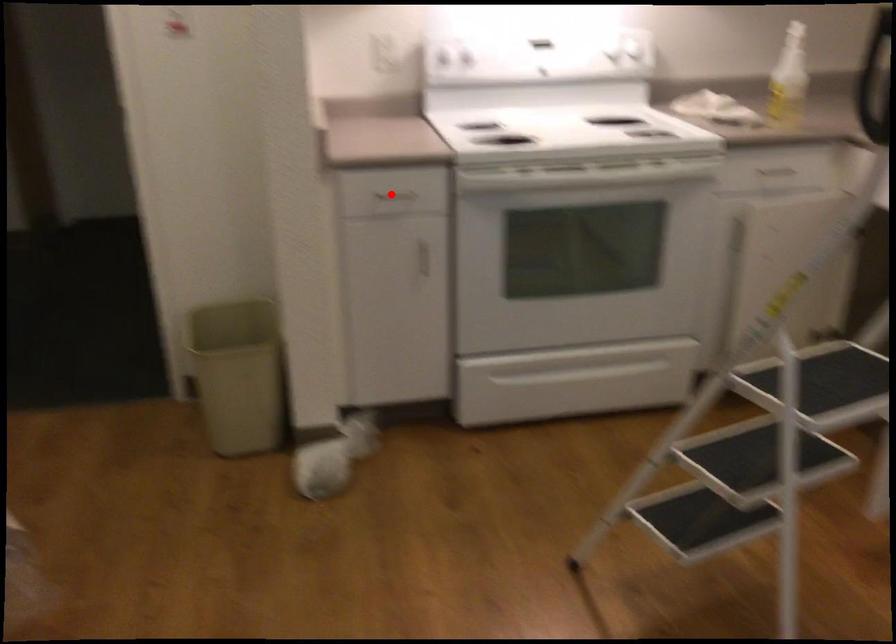
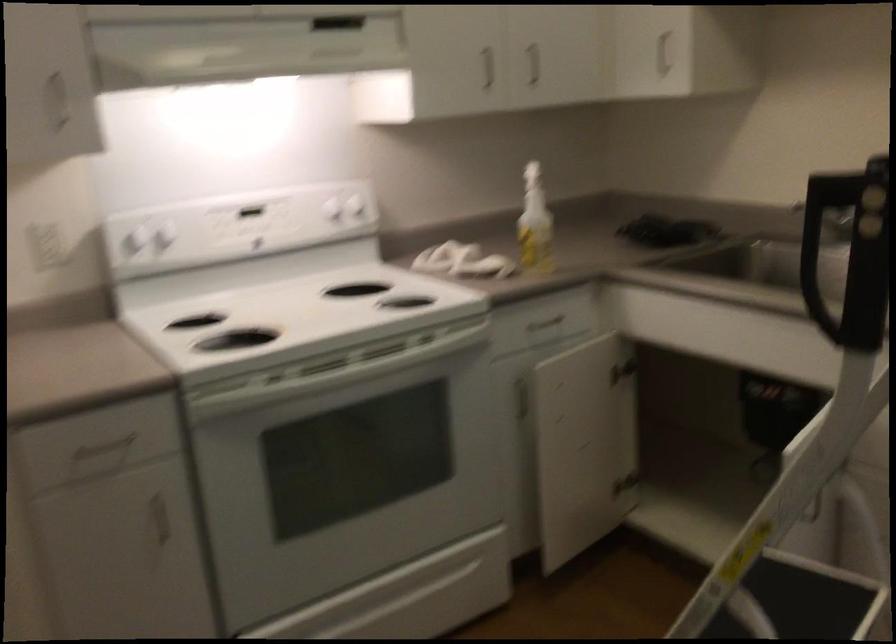
Where in the second image is the point corresponding to the highlighted location from the first image?

(102, 448)